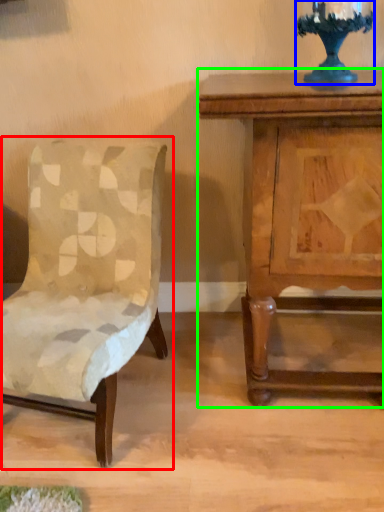
Question: Which object is positioned closest to chair (highlighted by a red box)? Select from candle holder (highlighted by a blue box) and nightstand (highlighted by a green box).

Choices:
 (A) candle holder
 (B) nightstand

Answer: (B)